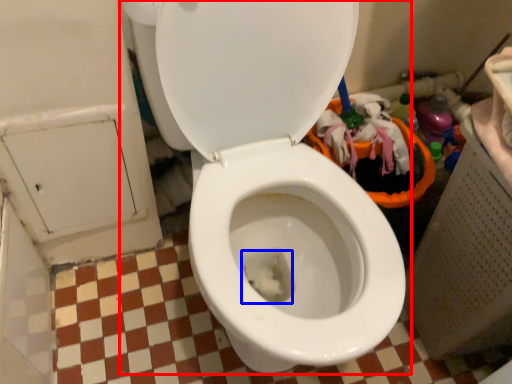
Question: Which of the following is the farthest to the observer, toilet (highlighted by a red box) or dust (highlighted by a blue box)?

Choices:
 (A) toilet
 (B) dust

Answer: (B)